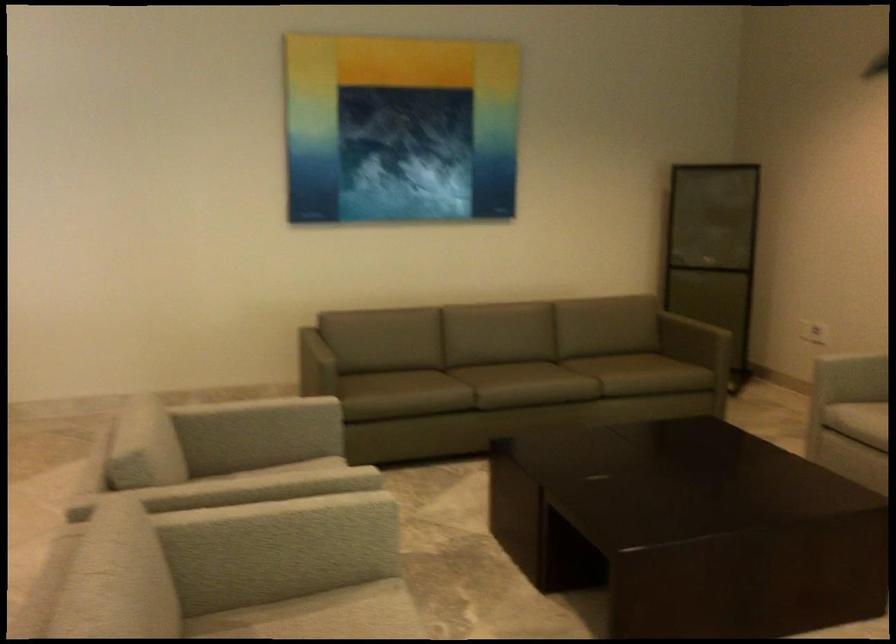
At what (x,y) coordinates should I click in order to perform the action: click on sofa sitting surface. Please return your answer as a coordinate pair (x, y). The width and height of the screenshot is (896, 644). Looking at the image, I should click on (524, 384).